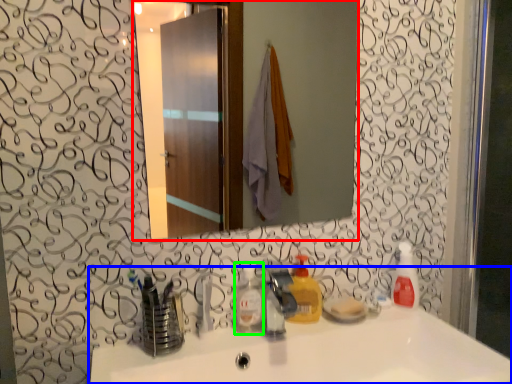
Question: Which object is the closest to the mirror (highlighted by a red box)? Choose among these: sink (highlighted by a blue box) or bottle (highlighted by a green box).

Choices:
 (A) sink
 (B) bottle

Answer: (A)